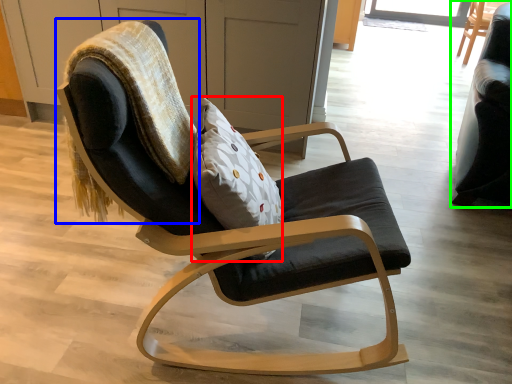
Question: Which object is positioned closest to pillow (highlighted by a red box)? Select from bean bag chair (highlighted by a blue box) and chair (highlighted by a green box).

Choices:
 (A) bean bag chair
 (B) chair

Answer: (A)